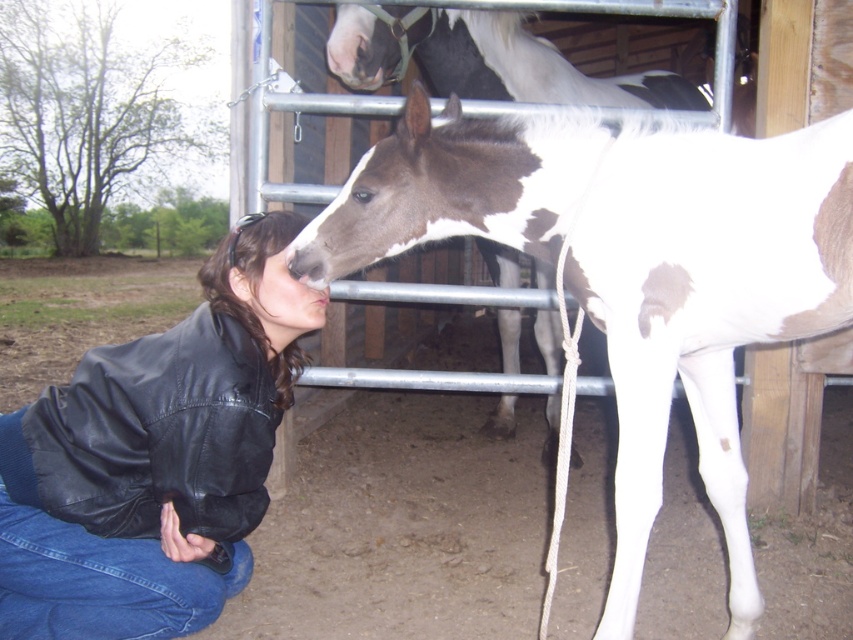
Looking at the scene where a woman is interacting with two horses in a stable, can you tell me which horse is positioned to the left of the other between the white glossy horse at center and the white and brown speckled horse at center?

The white glossy horse at center is positioned to the left of the white and brown speckled horse at center.

You are a farmer who needs to attach a halter to the white glossy horse at center. The halter is currently on the black leather jacket at lower left. Can you reach the halter without moving either the horse or the jacket?

The white glossy horse at center is 25.35 inches away from the black leather jacket at lower left. Since the halter is on the jacket, and the distance is about 25 inches, you can likely reach it if your arm length is sufficient, but you might need to stretch slightly.